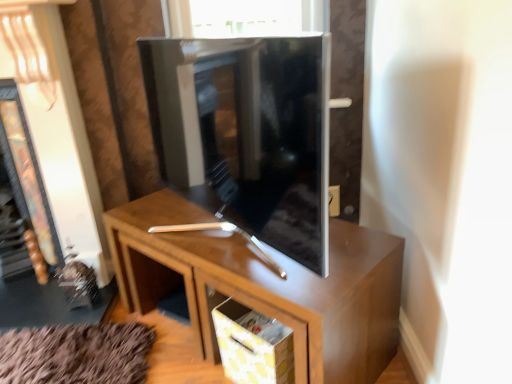
Question: Does yellow dotted fabric drawer at lower center have a lesser width compared to brown wood cabinet at center?

Choices:
 (A) no
 (B) yes

Answer: (B)

Question: Is the depth of yellow dotted fabric drawer at lower center greater than that of brown wood cabinet at center?

Choices:
 (A) no
 (B) yes

Answer: (B)

Question: Is brown wood cabinet at center at the back of yellow dotted fabric drawer at lower center?

Choices:
 (A) yes
 (B) no

Answer: (A)

Question: Can you confirm if yellow dotted fabric drawer at lower center is taller than brown wood cabinet at center?

Choices:
 (A) no
 (B) yes

Answer: (A)

Question: Can you confirm if yellow dotted fabric drawer at lower center is wider than brown wood cabinet at center?

Choices:
 (A) no
 (B) yes

Answer: (A)

Question: Relative to matte black fireplace at left, is yellow dotted fabric drawer at lower center in front or behind?

Choices:
 (A) front
 (B) behind

Answer: (A)

Question: From the image's perspective, is yellow dotted fabric drawer at lower center located above or below matte black fireplace at left?

Choices:
 (A) above
 (B) below

Answer: (B)

Question: Is yellow dotted fabric drawer at lower center bigger or smaller than matte black fireplace at left?

Choices:
 (A) big
 (B) small

Answer: (B)

Question: Visually, is yellow dotted fabric drawer at lower center positioned to the left or to the right of matte black fireplace at left?

Choices:
 (A) right
 (B) left

Answer: (A)

Question: From the image's perspective, is brown wood cabinet at center above or below matte black fireplace at left?

Choices:
 (A) below
 (B) above

Answer: (A)

Question: Do you think brown wood cabinet at center is within matte black fireplace at left, or outside of it?

Choices:
 (A) outside
 (B) inside

Answer: (A)

Question: Is brown wood cabinet at center wider or thinner than matte black fireplace at left?

Choices:
 (A) wide
 (B) thin

Answer: (A)

Question: Considering the positions of point (181, 211) and point (42, 253), is point (181, 211) closer or farther from the camera than point (42, 253)?

Choices:
 (A) closer
 (B) farther

Answer: (A)

Question: Is brown wood cabinet at center taller or shorter than yellow dotted fabric drawer at lower center?

Choices:
 (A) short
 (B) tall

Answer: (B)

Question: Considering the positions of brown wood cabinet at center and yellow dotted fabric drawer at lower center in the image, is brown wood cabinet at center wider or thinner than yellow dotted fabric drawer at lower center?

Choices:
 (A) thin
 (B) wide

Answer: (B)